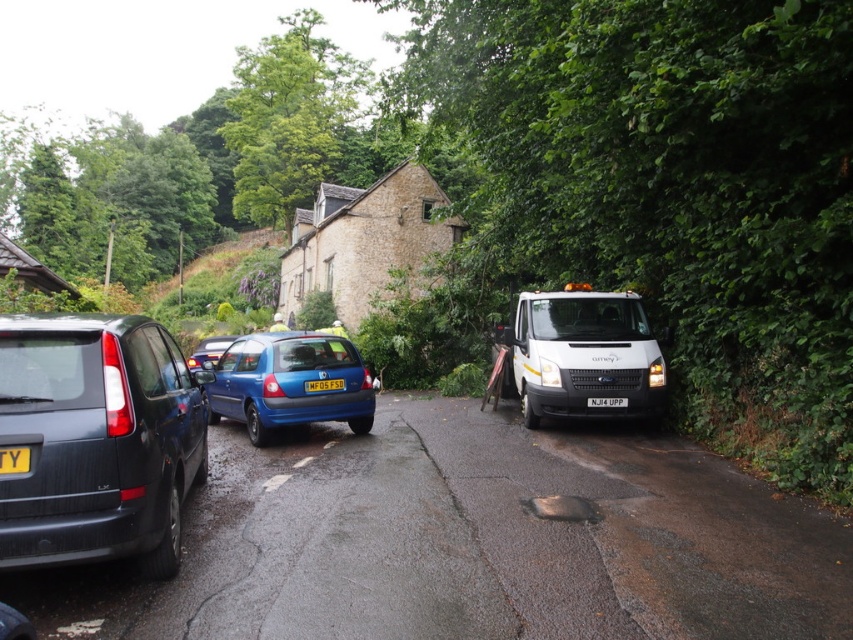
You are a delivery driver who needs to park your vehicle on the road. The road has a white glossy van at center. Where exactly should you park your vehicle to avoid blocking the road entirely?

The white glossy van at center is positioned at coordinates point (583,355). To avoid blocking the road entirely, park your vehicle away from this central area, perhaps near the edges where other vehicles are parked, ensuring there is enough space for traffic to pass through.

You are standing at the point closest to the stone building. Which of the two points, point (515,336) or point (306,387), is farther away from you?

Point (515,336) is farther away from you because it is behind point (306,387).